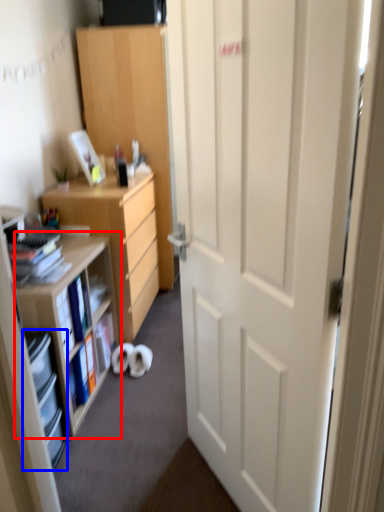
Question: Among these objects, which one is nearest to the camera, shelf (highlighted by a red box) or shelf (highlighted by a blue box)?

Choices:
 (A) shelf
 (B) shelf

Answer: (B)